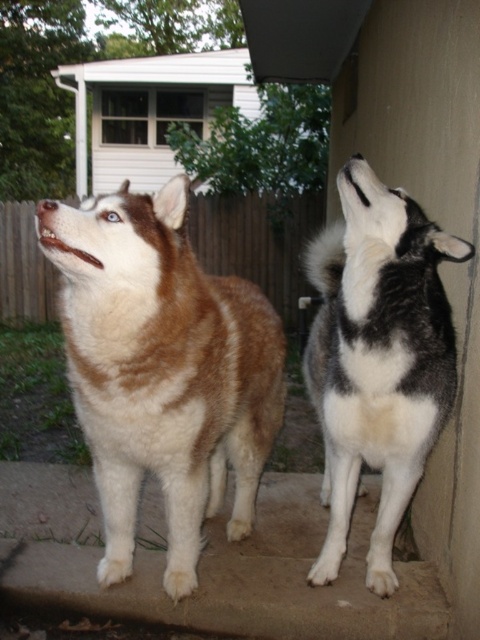
Is brown fur dog at center shorter than black and white fur dog at upper right?

Yes, brown fur dog at center is shorter than black and white fur dog at upper right.

Which is more to the left, brown fur dog at center or black and white fur dog at upper right?

Positioned to the left is brown fur dog at center.

The image size is (480, 640). Find the location of `brown fur dog at center`. brown fur dog at center is located at coordinates (163, 369).